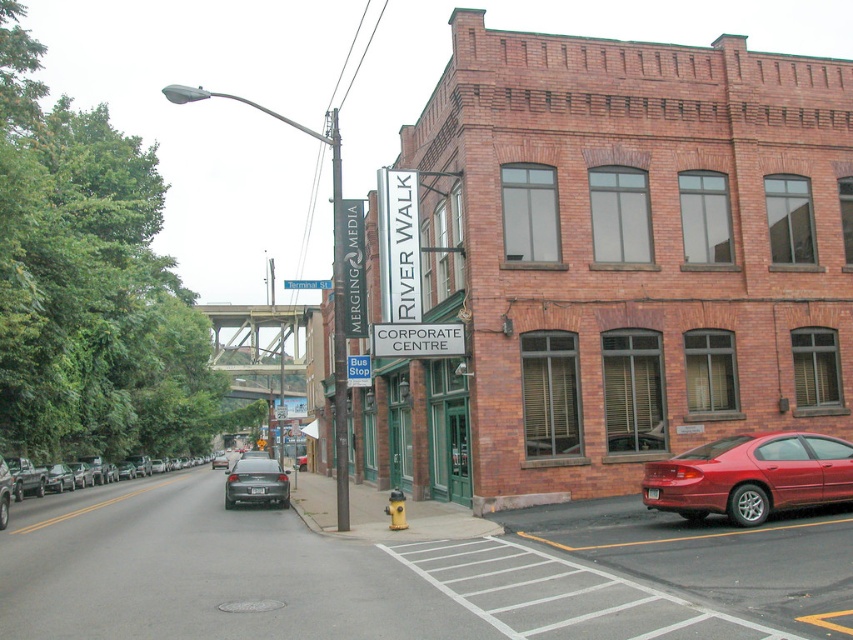
You are standing on the sidewalk in front of the River Walk Corporate Centre. You notice two points marked on the ground. The first point is at coordinates point (335, 400) and the second point is at point (285, 499). Which point is closer to you?

Point (335, 400) is closer to you than point (285, 499).

You are a delivery driver who needs to park your truck near the metallic gray signpost at center. However, there is a matte black sedan at center blocking the path. Based on the scene, can you determine if there is enough space to maneuver around the sedan and reach the signpost?

The metallic gray signpost at center is to the left of the matte black sedan at center, so you can maneuver around the sedan by moving to the left side of the sedan to reach the signpost.